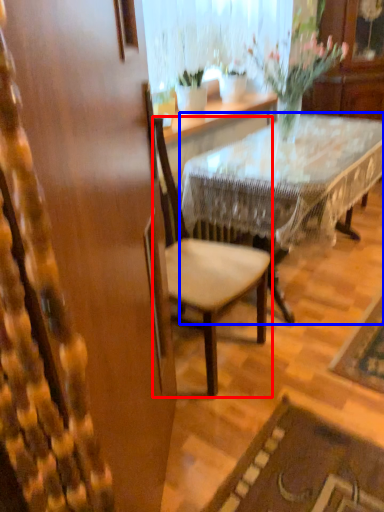
Question: Which object appears farthest to the camera in this image, chair (highlighted by a red box) or desk (highlighted by a blue box)?

Choices:
 (A) chair
 (B) desk

Answer: (B)